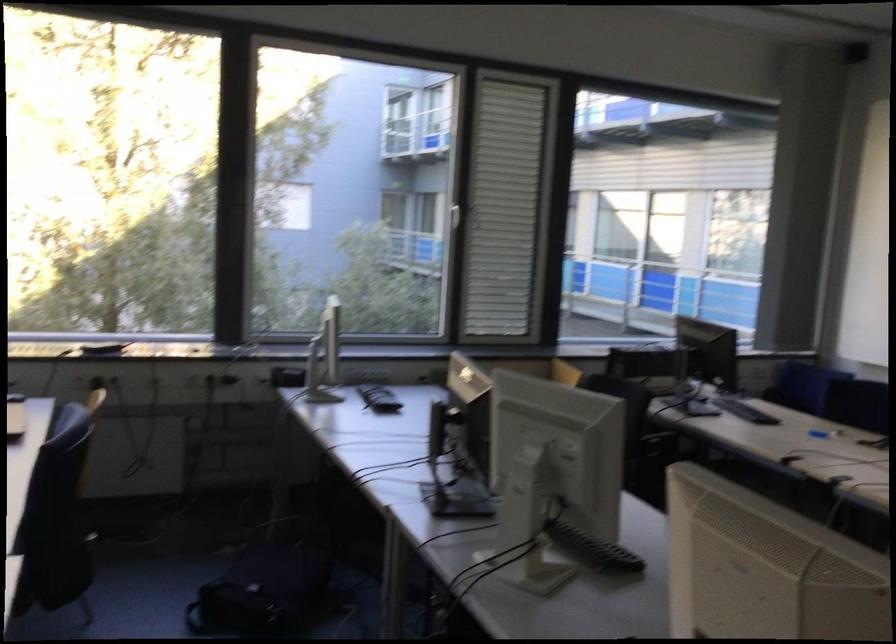
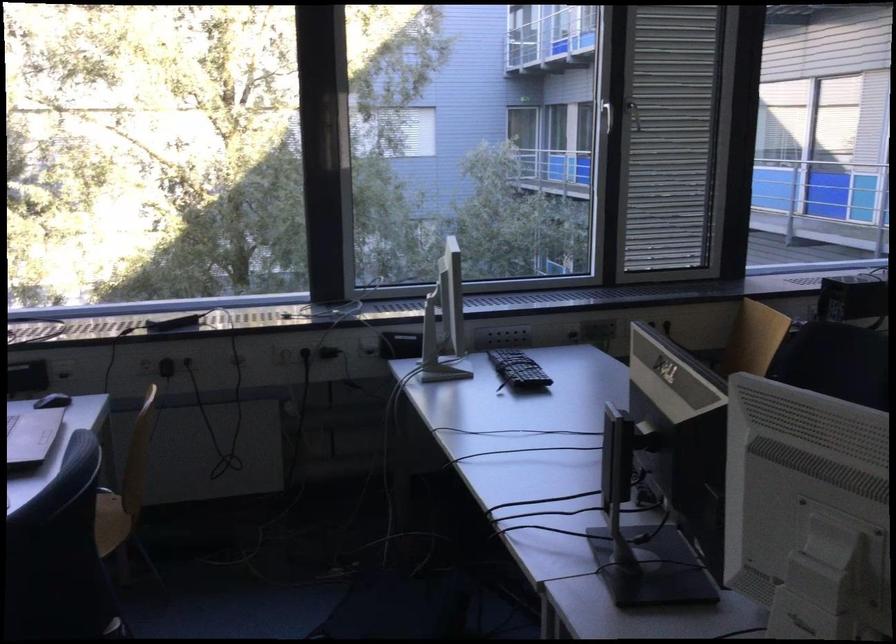
Question: The images are taken continuously from a first-person perspective. In which direction is your viewpoint rotating?

Choices:
 (A) Left
 (B) Right
 (C) Up
 (D) Down

Answer: (A)